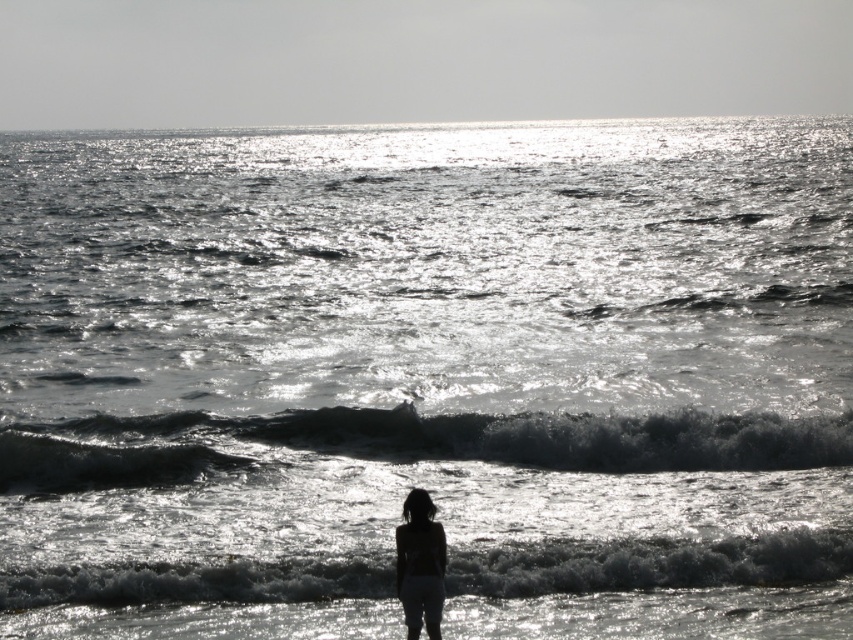
You are a photographer trying to capture the white frothy wave at lower center. You notice the shiny dark water at lower center in the background. Which object is taller in the image?

The white frothy wave at lower center is taller than the shiny dark water at lower center.

You are standing on the beach and see the point marked at coordinates (410, 444). What does this point represent in the scene?

The point at coordinates (410, 444) represents the shiny dark water at lower center.